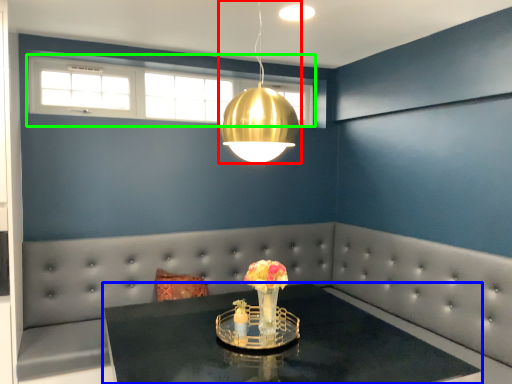
Question: Which object is the closest to the lamp (highlighted by a red box)? Choose among these: table (highlighted by a blue box) or window (highlighted by a green box).

Choices:
 (A) table
 (B) window

Answer: (A)